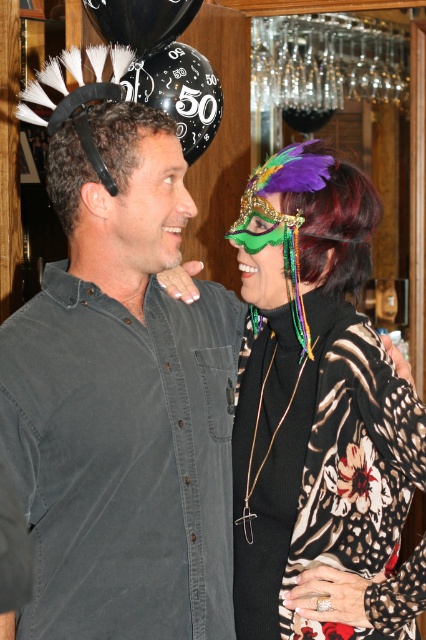
How far apart are dark gray shirt at center and floral-patterned fabric at center?

dark gray shirt at center and floral-patterned fabric at center are 12.73 inches apart from each other.

Is the position of dark gray shirt at center less distant than that of floral-patterned fabric at center?

Yes, it is.

Image resolution: width=426 pixels, height=640 pixels. I want to click on dark gray shirt at center, so click(123, 403).

Is dark gray shirt at center wider than green feathered mask at upper right?

Yes, dark gray shirt at center is wider than green feathered mask at upper right.

Who is more forward, (192, 445) or (270, 164)?

Positioned in front is point (192, 445).

Describe the element at coordinates (123, 403) in the screenshot. The image size is (426, 640). I see `dark gray shirt at center` at that location.

Locate an element on the screen. Image resolution: width=426 pixels, height=640 pixels. dark gray shirt at center is located at coordinates (123, 403).

The image size is (426, 640). Find the location of `shiny green mask at center`. shiny green mask at center is located at coordinates [319, 417].

The image size is (426, 640). What do you see at coordinates (319, 417) in the screenshot?
I see `shiny green mask at center` at bounding box center [319, 417].

Is point (311, 634) positioned after point (322, 547)?

That is False.

You are a GUI agent. You are given a task and a screenshot of the screen. Output one action in this format:
    pyautogui.click(x=<x>, y=<y>)
    Task: Click on the shiny green mask at center
    
    Given the screenshot: What is the action you would take?
    pyautogui.click(x=319, y=417)